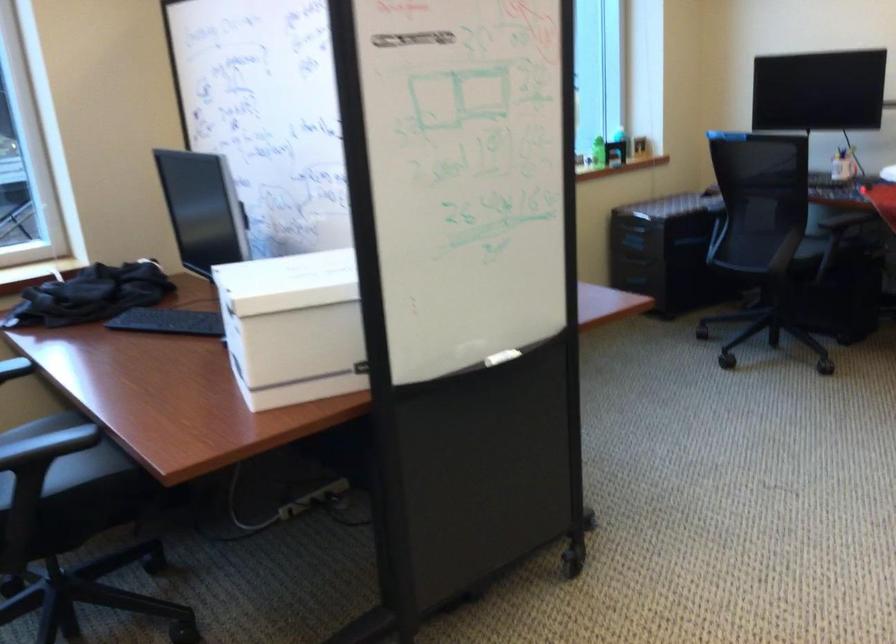
I want to click on whiteboard marker tray, so click(293, 327).